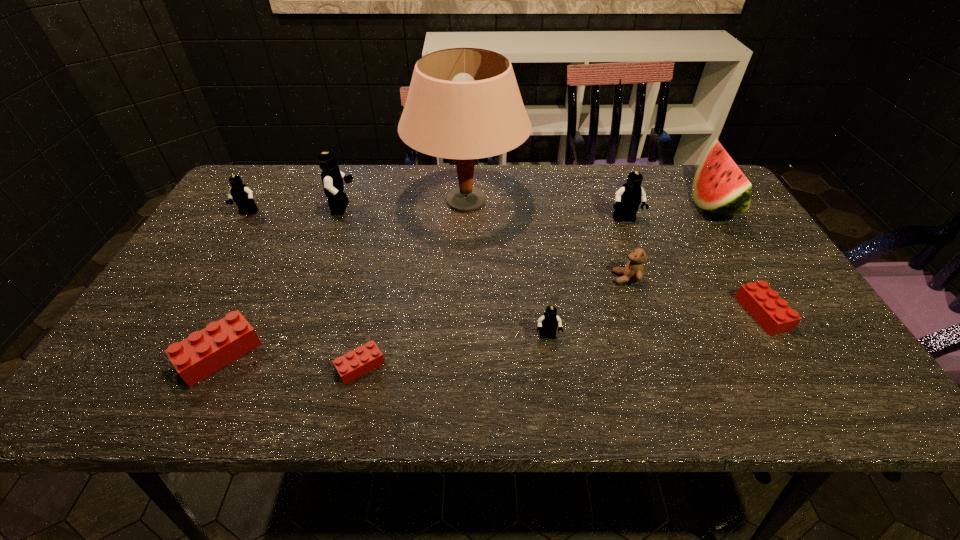
I want to click on vacant space located on the right of the sixth Lego from right to left, so click(352, 354).

This screenshot has height=540, width=960. Find the location of `vacant point located 0.160m on the left of the rightmost red Lego`. vacant point located 0.160m on the left of the rightmost red Lego is located at coordinates (673, 313).

Locate an element on the screen. This screenshot has width=960, height=540. vacant space located 0.130m on the back of the smallest red Lego is located at coordinates (374, 303).

You are a GUI agent. You are given a task and a screenshot of the screen. Output one action in this format:
    pyautogui.click(x=<x>, y=<y>)
    Task: Click on the lampshade at the far edge
    The height and width of the screenshot is (540, 960).
    Given the screenshot: What is the action you would take?
    pyautogui.click(x=463, y=103)

Find the location of a particular element. Lego that is at the far edge is located at coordinates (332, 178).

Where is `watermelon at the far edge`? This screenshot has width=960, height=540. watermelon at the far edge is located at coordinates (719, 186).

You are a GUI agent. You are given a task and a screenshot of the screen. Output one action in this format:
    pyautogui.click(x=<x>, y=<y>)
    Task: Click on the watermelon present at the right edge
    
    Given the screenshot: What is the action you would take?
    pyautogui.click(x=719, y=186)

Where is `Lego located in the right edge section of the desktop`? The image size is (960, 540). Lego located in the right edge section of the desktop is located at coordinates (772, 313).

I want to click on object located in the near left corner section of the desktop, so click(x=204, y=352).

In order to click on object situated at the far right corner in this screenshot , I will do `click(719, 186)`.